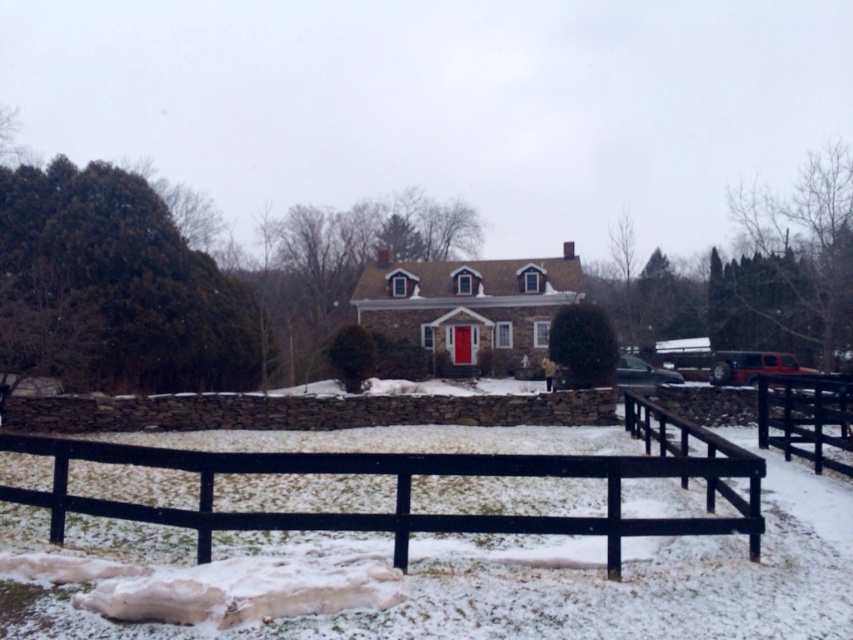
Is black wooden fence at center to the right of black wooden fence at lower right from the viewer's perspective?

In fact, black wooden fence at center is to the left of black wooden fence at lower right.

Does black wooden fence at center have a smaller size compared to black wooden fence at lower right?

Yes.

Does point (438, 513) lie in front of point (820, 412)?

That is True.

Find the location of `black wooden fence at center`. black wooden fence at center is located at coordinates (410, 486).